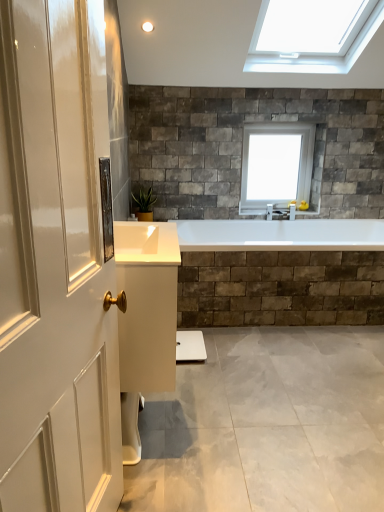
Question: Considering the relative positions of transparent glass window at upper center and green glossy plant at lower left in the image provided, is transparent glass window at upper center to the left of green glossy plant at lower left from the viewer's perspective?

Choices:
 (A) no
 (B) yes

Answer: (A)

Question: Considering the relative sizes of transparent glass window at upper center and green glossy plant at lower left in the image provided, is transparent glass window at upper center shorter than green glossy plant at lower left?

Choices:
 (A) yes
 (B) no

Answer: (B)

Question: Is transparent glass window at upper center in contact with green glossy plant at lower left?

Choices:
 (A) no
 (B) yes

Answer: (A)

Question: Can we say transparent glass window at upper center lies outside green glossy plant at lower left?

Choices:
 (A) no
 (B) yes

Answer: (B)

Question: From the image's perspective, is transparent glass window at upper center on top of green glossy plant at lower left?

Choices:
 (A) yes
 (B) no

Answer: (A)

Question: Considering the relative sizes of transparent glass window at upper center and green glossy plant at lower left in the image provided, is transparent glass window at upper center wider than green glossy plant at lower left?

Choices:
 (A) no
 (B) yes

Answer: (A)

Question: From a real-world perspective, is green glossy plant at lower left over transparent glass window at upper center?

Choices:
 (A) no
 (B) yes

Answer: (A)

Question: From the image's perspective, is green glossy plant at lower left under transparent glass window at upper center?

Choices:
 (A) yes
 (B) no

Answer: (A)

Question: Is green glossy plant at lower left thinner than transparent glass window at upper center?

Choices:
 (A) yes
 (B) no

Answer: (B)

Question: Would you consider green glossy plant at lower left to be distant from transparent glass window at upper center?

Choices:
 (A) no
 (B) yes

Answer: (B)

Question: Would you say green glossy plant at lower left is outside transparent glass window at upper center?

Choices:
 (A) no
 (B) yes

Answer: (B)

Question: Are green glossy plant at lower left and transparent glass window at upper center beside each other?

Choices:
 (A) no
 (B) yes

Answer: (A)

Question: Looking at the image, does transparent glass window at upper center seem bigger or smaller compared to green glossy plant at lower left?

Choices:
 (A) big
 (B) small

Answer: (A)